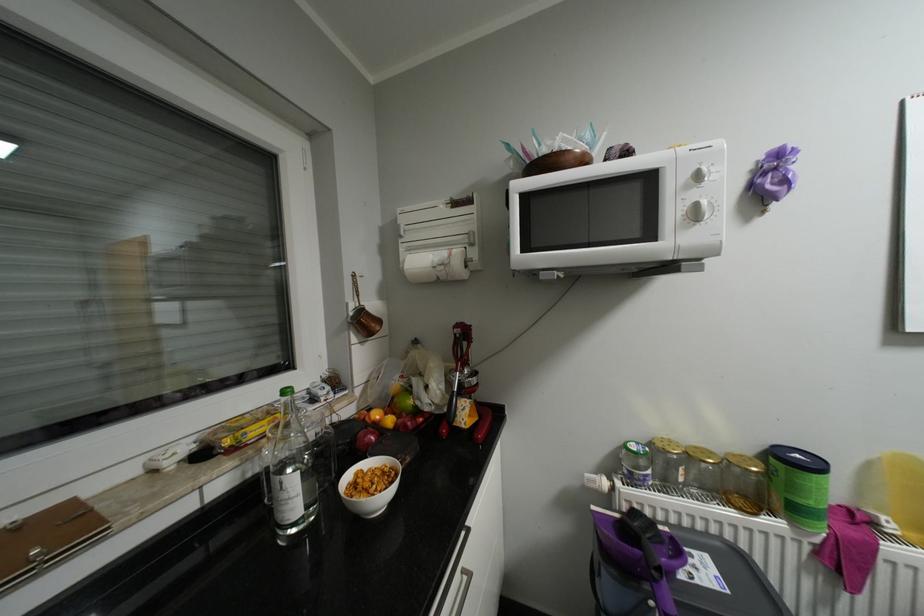
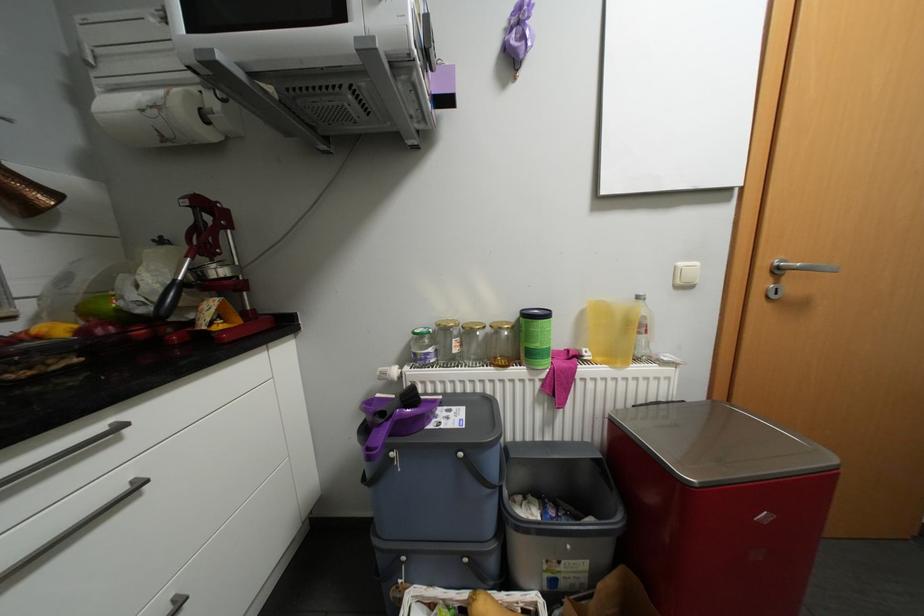
Question: The images are taken continuously from a first-person perspective. In which direction are you moving?

Choices:
 (A) Left
 (B) Right
 (C) Forward
 (D) Backward

Answer: (B)